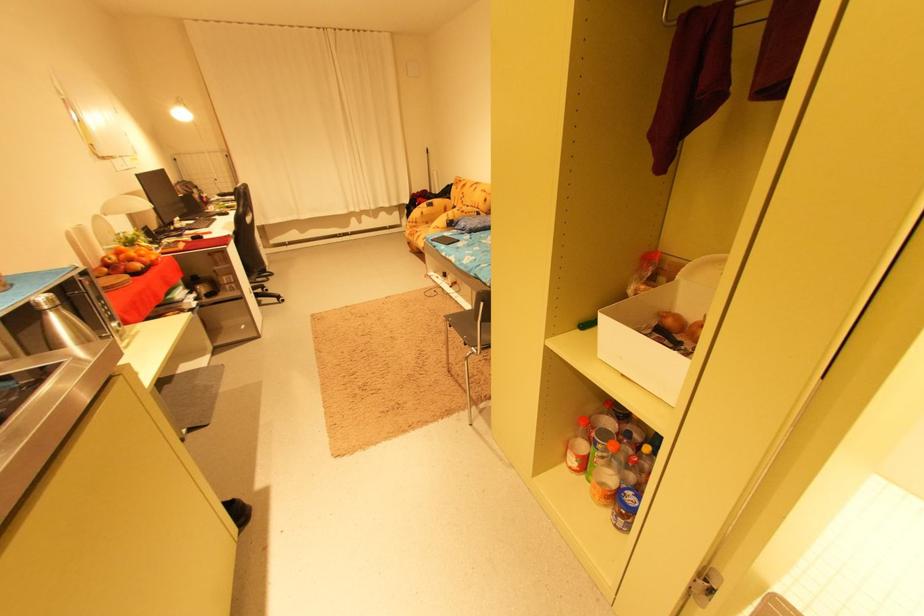
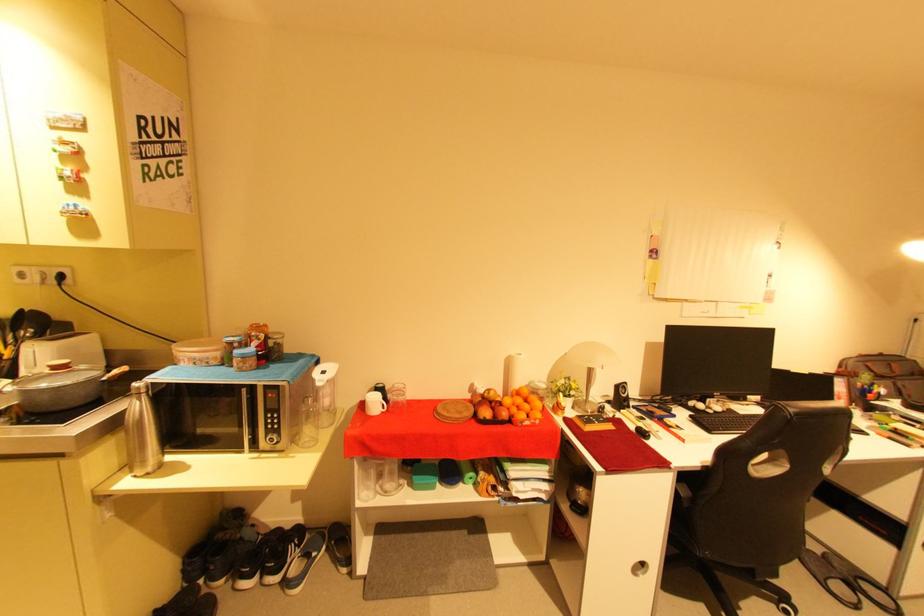
In the second image, find the point that corresponds to [151,265] in the first image.

(503, 416)